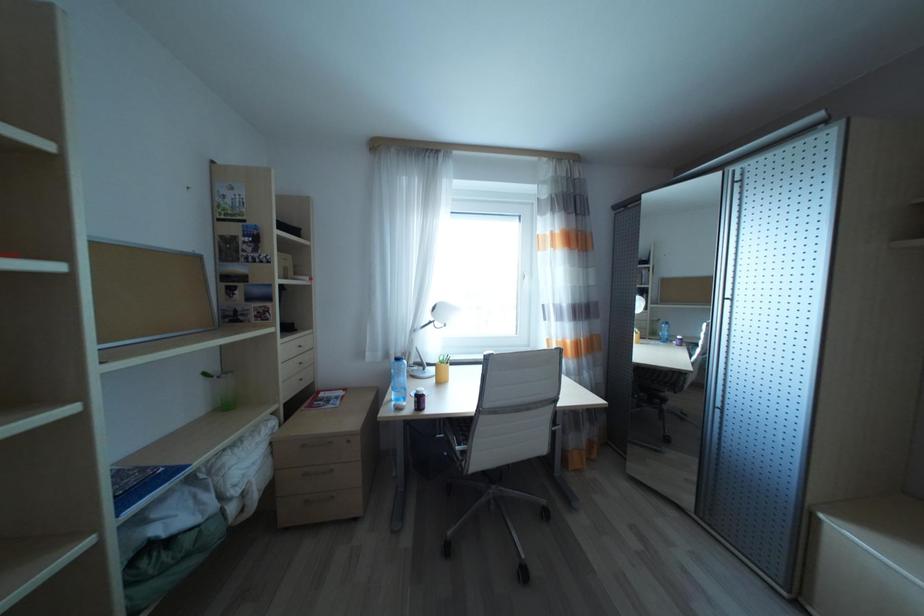
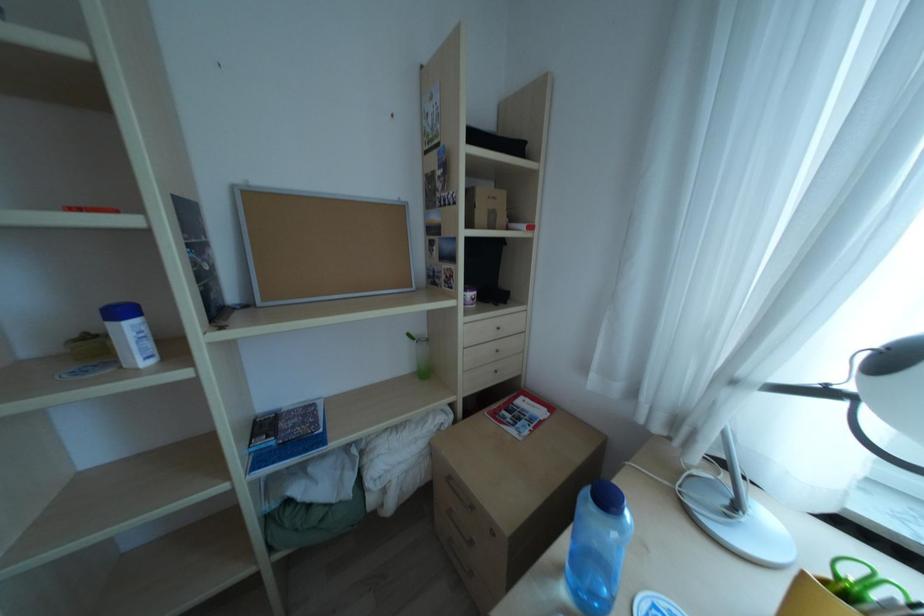
Question: The camera is either moving clockwise (left) or counter-clockwise (right) around the object. The first image is from the beginning of the video and the second image is from the end. Is the camera moving left or right when shooting the video?

Choices:
 (A) Left
 (B) Right

Answer: (B)